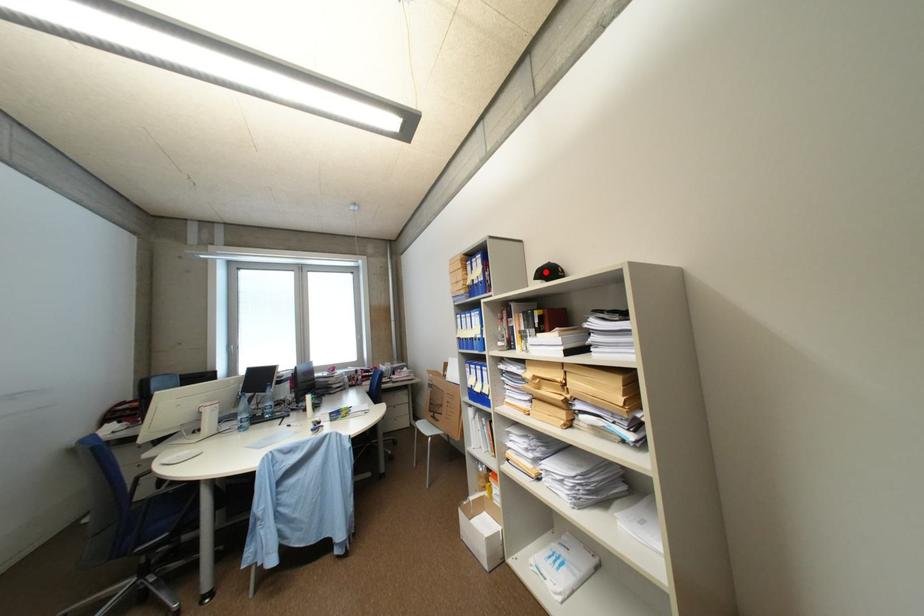
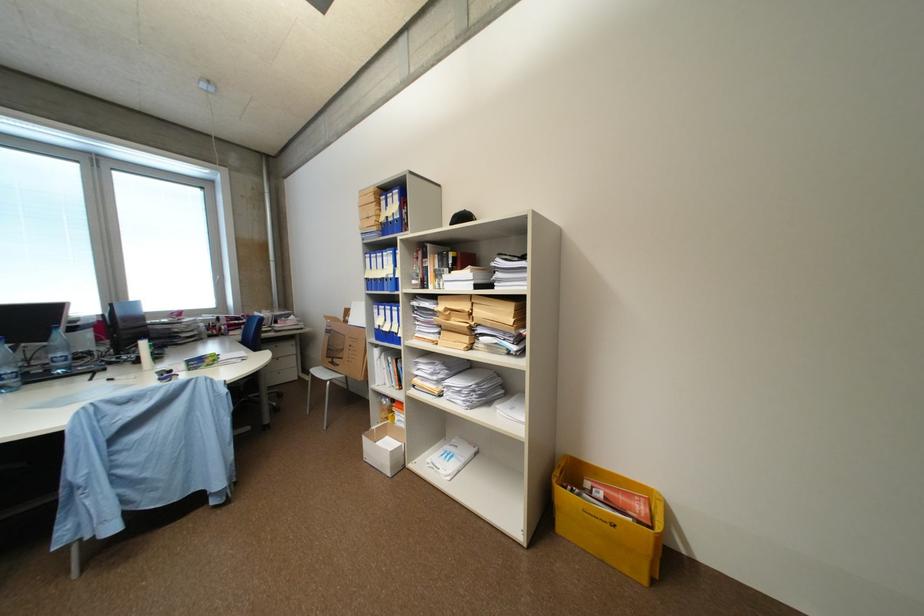
The point at the highlighted location is marked in the first image. Where is the corresponding point in the second image?

(463, 217)